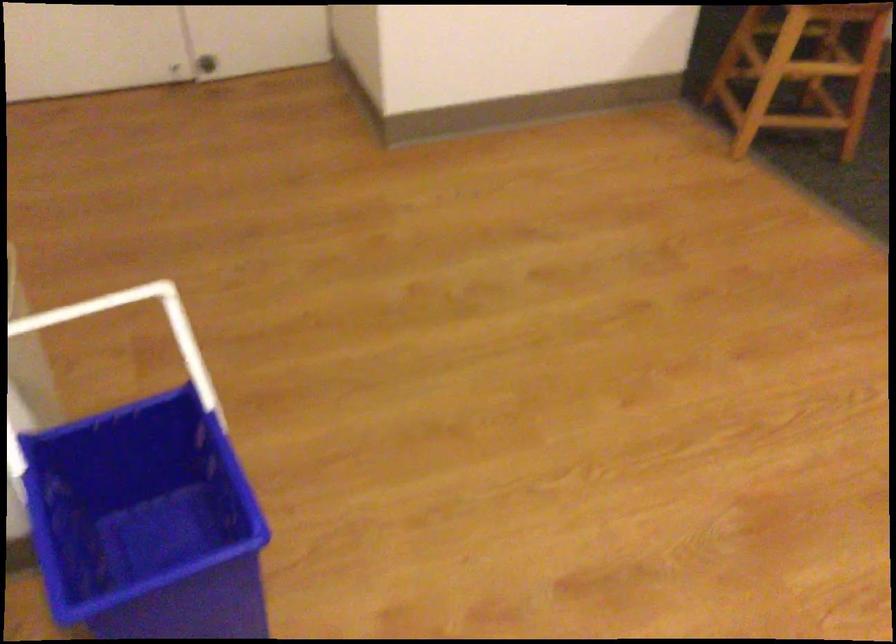
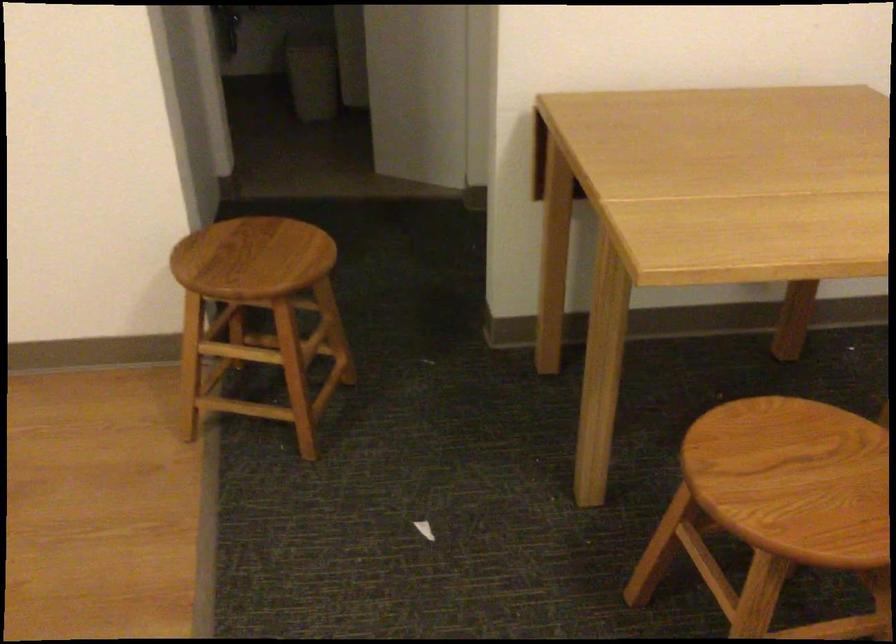
Question: The images are taken continuously from a first-person perspective. In which direction are you moving?

Choices:
 (A) Left
 (B) Right
 (C) Forward
 (D) Backward

Answer: (B)